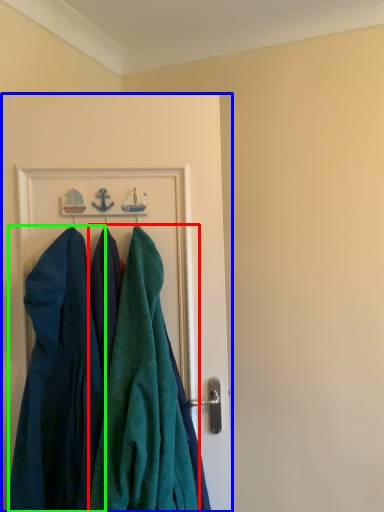
Question: Which object is the farthest from towel (highlighted by a red box)? Choose among these: door (highlighted by a blue box) or dress (highlighted by a green box).

Choices:
 (A) door
 (B) dress

Answer: (A)